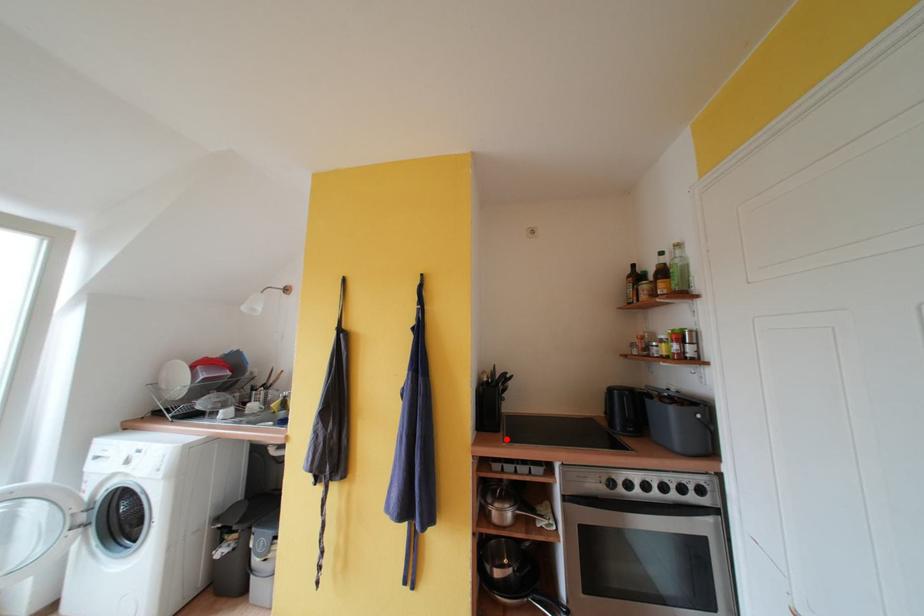
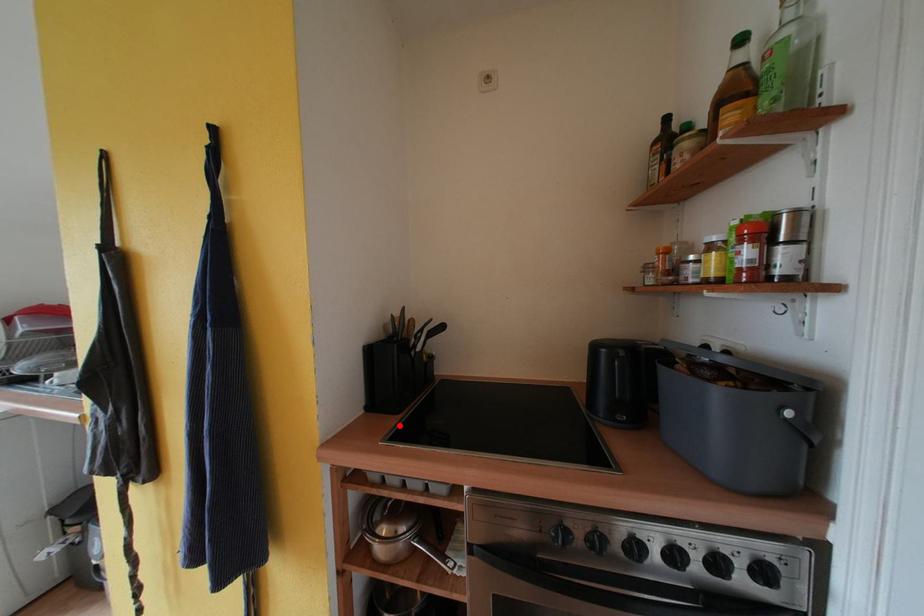
I am providing you with two images of the same scene from different viewpoints. A red point is marked on the first image and another point is marked on the second image. Is the marked point in image1 the same physical position as the marked point in image2?

Yes